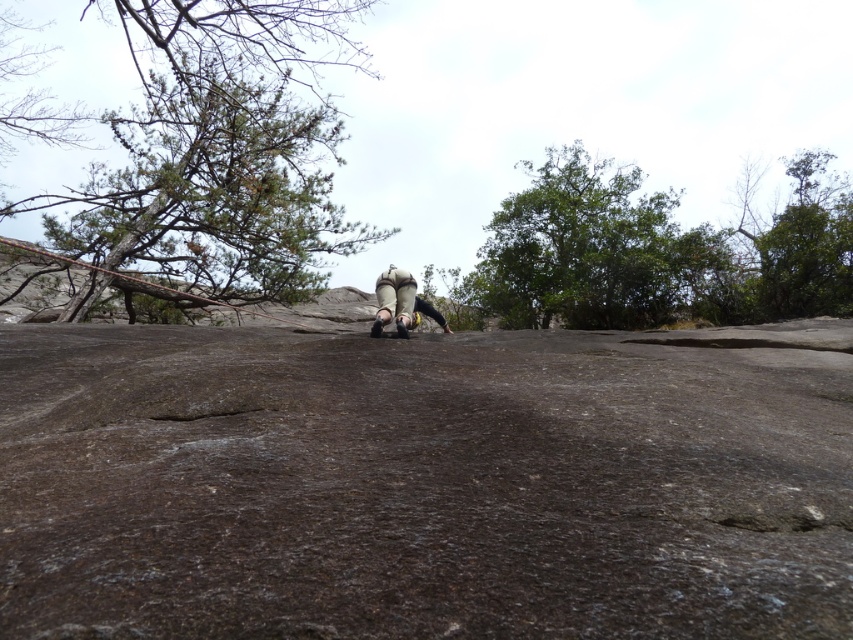
Question: Which point is farther to the camera?

Choices:
 (A) (650, 291)
 (B) (805, 189)
 (C) (151, 257)

Answer: (B)

Question: Is the position of green textured tree at upper left less distant than that of green leafy tree at upper right?

Choices:
 (A) yes
 (B) no

Answer: (A)

Question: Based on their relative distances, which object is farther from the green textured tree at upper left?

Choices:
 (A) matte gray climbing shoes at center
 (B) green leafy tree at upper center

Answer: (A)

Question: Which of the following is the farthest from the observer?

Choices:
 (A) (405, 326)
 (B) (628, 305)

Answer: (B)

Question: From the image, what is the correct spatial relationship of green leafy tree at upper center in relation to green leafy tree at upper right?

Choices:
 (A) above
 (B) below

Answer: (A)

Question: Can you confirm if green leafy tree at upper center is positioned to the right of green leafy tree at upper right?

Choices:
 (A) yes
 (B) no

Answer: (B)